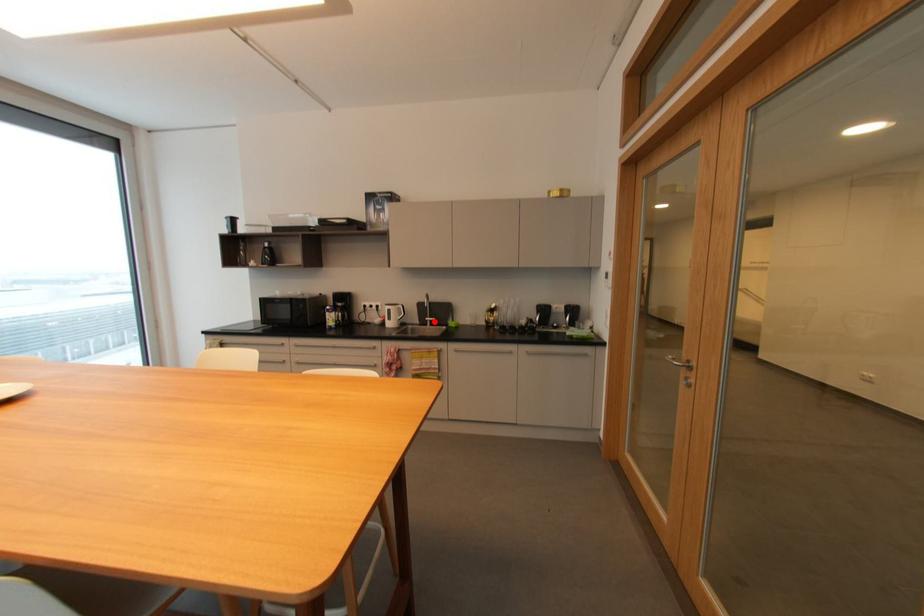
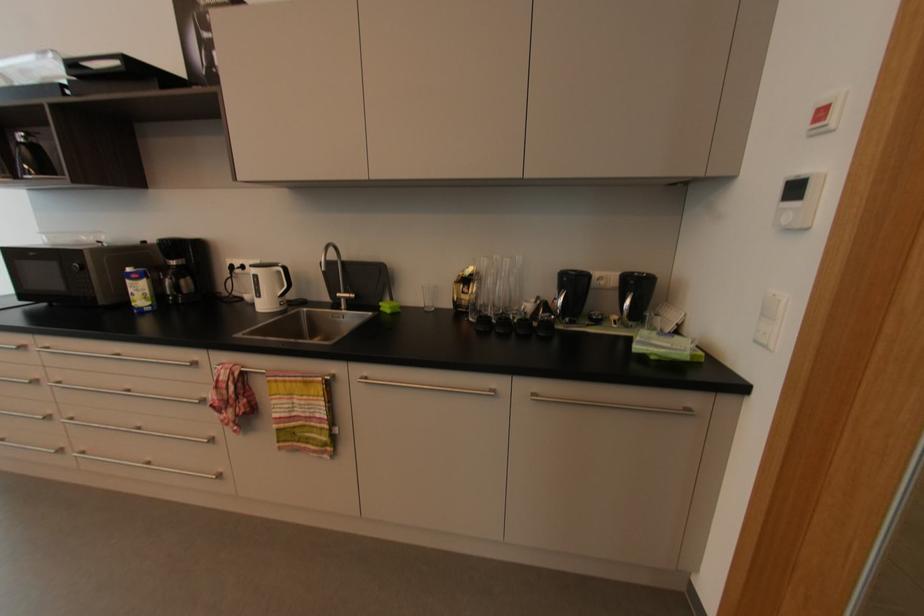
Find the pixel in the second image that matches the highlighted location in the first image.

(350, 300)